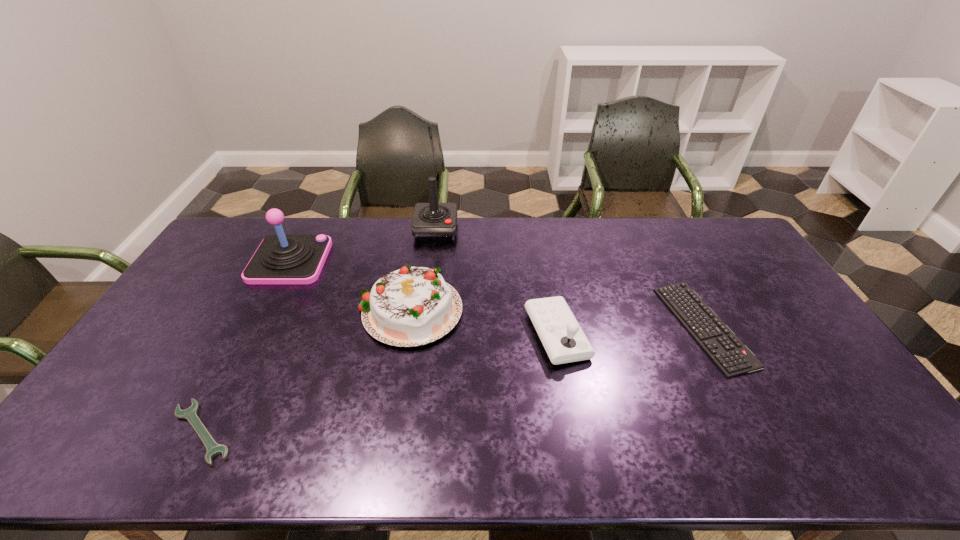
The image size is (960, 540). What are the coordinates of `vacant space in between the second joystick from left to right and the computer keyboard` in the screenshot? It's located at (569, 278).

I want to click on free space between the leftmost joystick and the second joystick from right to left, so click(x=363, y=245).

Where is `vacant area that lies between the shortest joystick and the shortest object`? vacant area that lies between the shortest joystick and the shortest object is located at coordinates point(379,383).

Identify the location of free space that is in between the third shortest object and the cake. The image size is (960, 540). (484, 321).

Locate an element on the screen. blank region between the fifth object from left to right and the fifth tallest object is located at coordinates tap(630, 330).

Find the location of a particular element. vacant space that's between the nearest object and the computer keyboard is located at coordinates (452, 379).

This screenshot has width=960, height=540. I want to click on object that is the closest to the cake, so click(280, 259).

Locate which object is the third closest to the nearest object. Please provide its 2D coordinates. Your answer should be formatted as a tuple, i.e. [(x, y)], where the tuple contains the x and y coordinates of a point satisfying the conditions above.

[(561, 335)]

Point out which joystick is positioned as the nearest to the leftmost joystick. Please provide its 2D coordinates. Your answer should be formatted as a tuple, i.e. [(x, y)], where the tuple contains the x and y coordinates of a point satisfying the conditions above.

[(431, 221)]

Locate an element on the screen. The width and height of the screenshot is (960, 540). joystick that is the closest to the second joystick from right to left is located at coordinates pos(280,259).